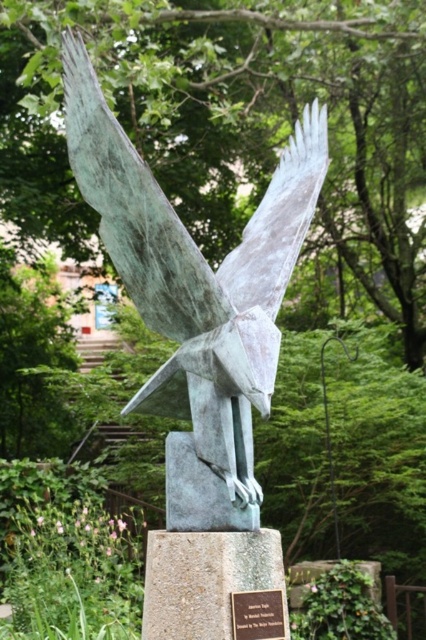
Question: Among these points, which one is farthest from the camera?

Choices:
 (A) (144, 308)
 (B) (271, 602)

Answer: (A)

Question: Does green patina eagle at center appear on the left side of bronze plaque at center?

Choices:
 (A) yes
 (B) no

Answer: (A)

Question: Does green patina eagle at center have a lesser width compared to bronze plaque at center?

Choices:
 (A) no
 (B) yes

Answer: (A)

Question: Does green patina eagle at center appear under bronze plaque at center?

Choices:
 (A) yes
 (B) no

Answer: (B)

Question: Which object appears closest to the camera in this image?

Choices:
 (A) green patina eagle at center
 (B) bronze plaque at center

Answer: (A)